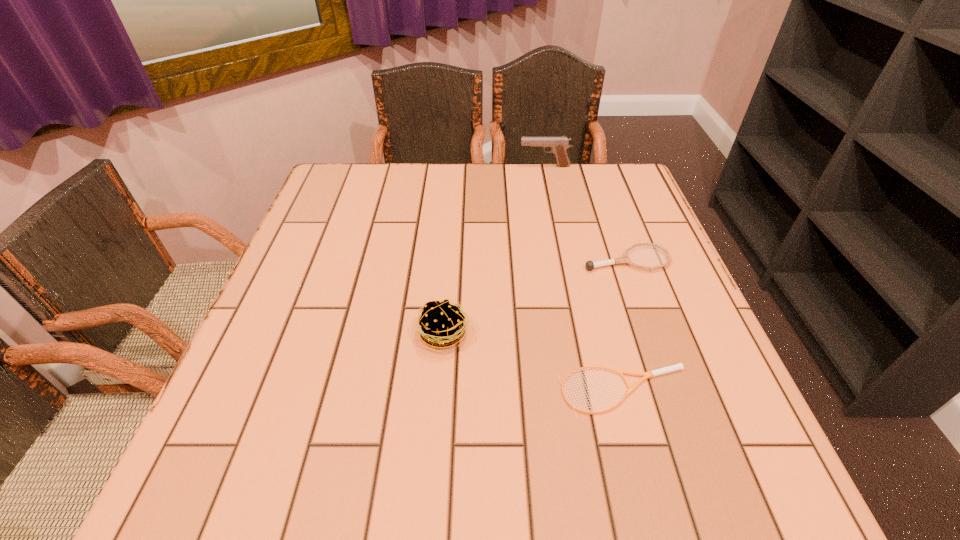
Find the location of a particular element. vacant space situated 0.140m at the barrel of the farthest object is located at coordinates (472, 166).

Image resolution: width=960 pixels, height=540 pixels. In order to click on vacant space positioned 0.220m on the left of the patty in this screenshot , I will do `click(304, 334)`.

Identify the location of vacant space situated 0.050m on the left of the farther tennis racket. tap(561, 260).

Where is `blank space located on the back of the shorter tennis racket`? Image resolution: width=960 pixels, height=540 pixels. blank space located on the back of the shorter tennis racket is located at coordinates (587, 248).

I want to click on object that is at the far edge, so click(559, 145).

Locate an element on the screen. The width and height of the screenshot is (960, 540). vacant space at the far edge of the desktop is located at coordinates 412,174.

Locate an element on the screen. The width and height of the screenshot is (960, 540). free spot at the near edge of the desktop is located at coordinates (497, 475).

Where is `free space at the left edge`? free space at the left edge is located at coordinates (323, 227).

You are a GUI agent. You are given a task and a screenshot of the screen. Output one action in this format:
    pyautogui.click(x=<x>, y=<y>)
    Task: Click on the vacant space at the right edge
    The height and width of the screenshot is (540, 960).
    Given the screenshot: What is the action you would take?
    pyautogui.click(x=630, y=339)

In order to click on free point at the near left corner in this screenshot , I will do `click(213, 473)`.